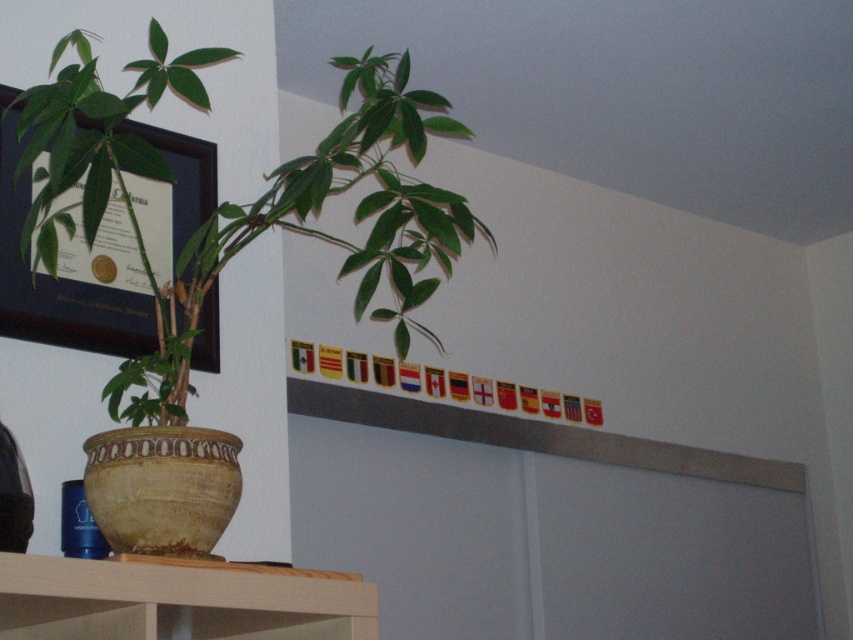
Question: Is wooden at lower left thinner than matte black frame at upper left?

Choices:
 (A) no
 (B) yes

Answer: (A)

Question: Estimate the real-world distances between objects in this image. Which object is farther from the matte black frame at upper left?

Choices:
 (A) wooden at lower left
 (B) green matte plant at left

Answer: (A)

Question: Among these points, which one is farthest from the camera?

Choices:
 (A) (213, 292)
 (B) (170, 74)

Answer: (A)

Question: In this image, where is green matte plant at left located relative to wooden at lower left?

Choices:
 (A) below
 (B) above

Answer: (B)

Question: Does green matte plant at left have a greater width compared to matte black frame at upper left?

Choices:
 (A) no
 (B) yes

Answer: (B)

Question: Among these objects, which one is farthest from the camera?

Choices:
 (A) wooden at lower left
 (B) green matte plant at left
 (C) matte black frame at upper left

Answer: (C)